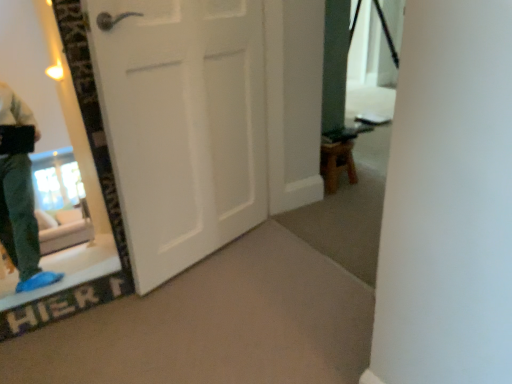
Question: Visually, is wooden stool at lower right positioned to the left or to the right of white matte door at center?

Choices:
 (A) left
 (B) right

Answer: (B)

Question: Is wooden stool at lower right inside or outside of white matte door at center?

Choices:
 (A) outside
 (B) inside

Answer: (A)

Question: From a real-world perspective, is wooden stool at lower right above or below white matte door at center?

Choices:
 (A) below
 (B) above

Answer: (A)

Question: Considering the positions of white matte door at center and wooden stool at lower right in the image, is white matte door at center wider or thinner than wooden stool at lower right?

Choices:
 (A) thin
 (B) wide

Answer: (A)

Question: Visually, is white matte door at center positioned to the left or to the right of wooden stool at lower right?

Choices:
 (A) left
 (B) right

Answer: (A)

Question: In terms of height, does white matte door at center look taller or shorter compared to wooden stool at lower right?

Choices:
 (A) short
 (B) tall

Answer: (B)

Question: From the image's perspective, is white matte door at center above or below wooden stool at lower right?

Choices:
 (A) above
 (B) below

Answer: (B)